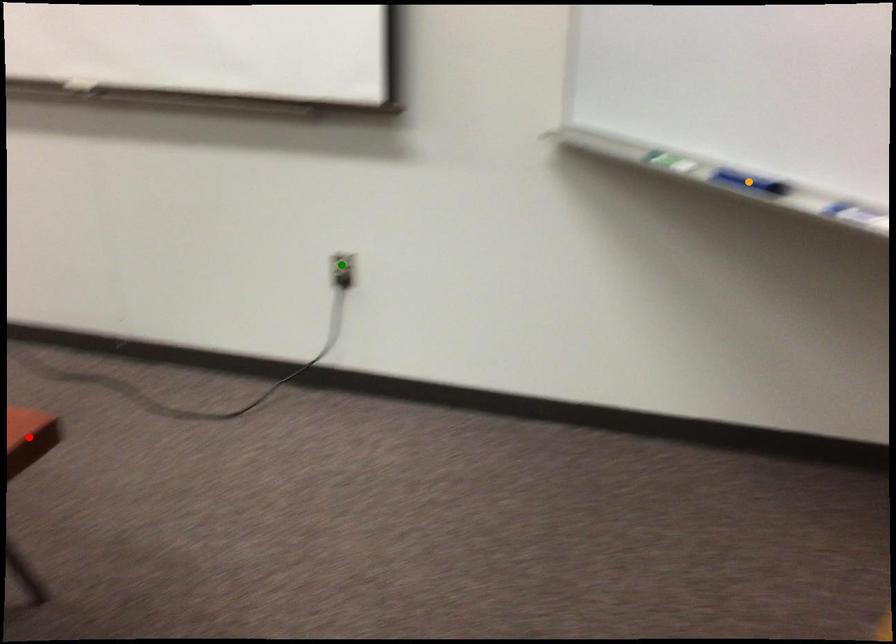
Order these from nearest to farthest:
red point, orange point, green point

red point → green point → orange point